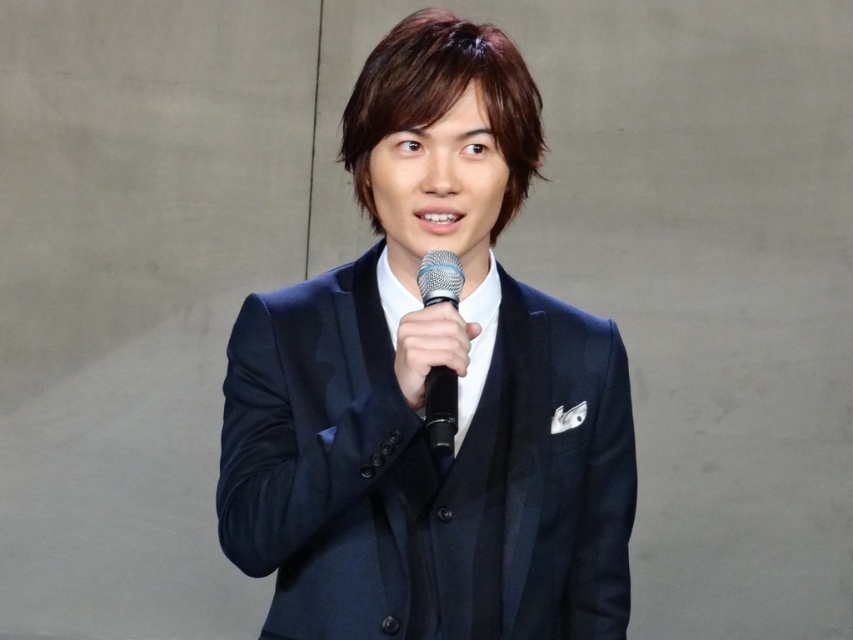
Is point (300, 518) positioned in front of point (424, 301)?

No, it is not.

Can you confirm if navy blue suit at center is shorter than black matte microphone at center?

No, navy blue suit at center is not shorter than black matte microphone at center.

Describe the element at coordinates (422, 387) in the screenshot. I see `navy blue suit at center` at that location.

The image size is (853, 640). Find the location of `navy blue suit at center`. navy blue suit at center is located at coordinates (422, 387).